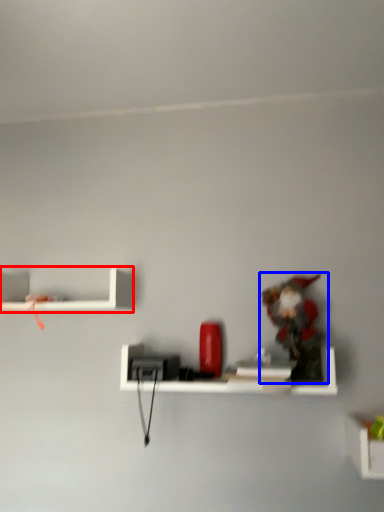
Question: Which object is closer to the camera taking this photo, shelf (highlighted by a red box) or toy (highlighted by a blue box)?

Choices:
 (A) shelf
 (B) toy

Answer: (B)